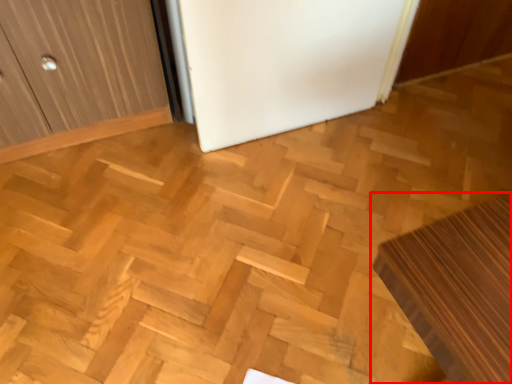
Question: Where is furniture (annotated by the red box) located in relation to fridge in the image?

Choices:
 (A) left
 (B) right

Answer: (B)